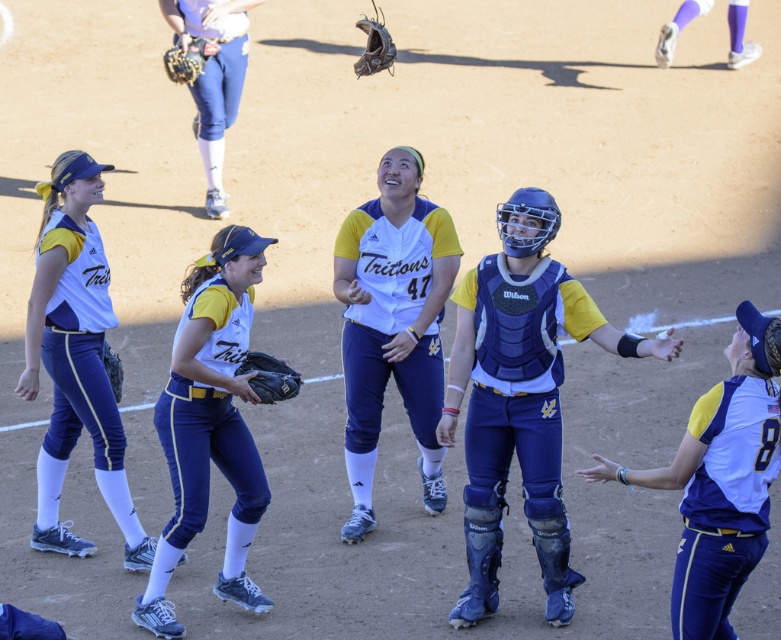
Question: Considering the relative positions of blue padded catcher at center and white matte jersey at lower right in the image provided, where is blue padded catcher at center located with respect to white matte jersey at lower right?

Choices:
 (A) left
 (B) right

Answer: (A)

Question: Does white matte jersey at center appear on the left side of white matte uniform at left?

Choices:
 (A) no
 (B) yes

Answer: (A)

Question: Considering the real-world distances, which object is closest to the white matte jersey at center?

Choices:
 (A) brown leather glove at upper left
 (B) brown leather glove at upper center

Answer: (A)

Question: Among these objects, which one is nearest to the camera?

Choices:
 (A) white matte jersey at lower right
 (B) matte blue uniform at center
 (C) white matte uniform at left

Answer: (A)

Question: Based on their relative distances, which object is farther from the blue padded catcher at center?

Choices:
 (A) matte blue uniform at center
 (B) brown leather glove at upper center
 (C) dark brown leather glove at center
 (D) dark gray leather glove at lower left

Answer: (B)

Question: Does matte blue uniform at center have a lesser width compared to white matte jersey at lower right?

Choices:
 (A) yes
 (B) no

Answer: (B)